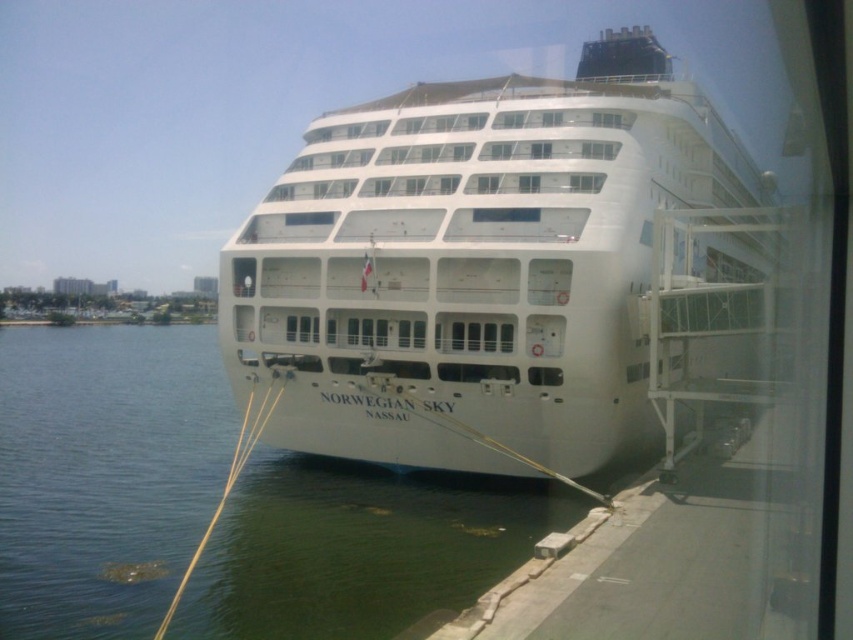
Question: Can you confirm if white glossy cruise ship at center is bigger than clear water at lower left?

Choices:
 (A) no
 (B) yes

Answer: (A)

Question: Which of the following is the closest to the observer?

Choices:
 (A) (12, 572)
 (B) (599, 236)

Answer: (A)

Question: Among these points, which one is nearest to the camera?

Choices:
 (A) (581, 124)
 (B) (177, 358)

Answer: (A)

Question: Can you confirm if white glossy cruise ship at center is positioned above clear water at lower left?

Choices:
 (A) no
 (B) yes

Answer: (B)

Question: Is white glossy cruise ship at center smaller than clear water at lower left?

Choices:
 (A) yes
 (B) no

Answer: (A)